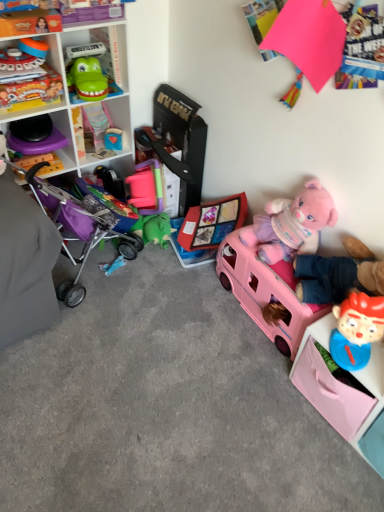
Question: From a real-world perspective, relative to purple fabric stroller at left, is matte plastic shelf at upper left, the 1th shelf from the top, vertically above or below?

Choices:
 (A) below
 (B) above

Answer: (B)

Question: Would you say matte plastic shelf at upper left, the second shelf when ordered from right to left, is inside or outside purple fabric stroller at left?

Choices:
 (A) outside
 (B) inside

Answer: (A)

Question: Estimate the real-world distances between objects in this image. Which object is farther from the purple plastic cabinet at left, positioned as the first cabinet in left-to-right order?

Choices:
 (A) pink plastic toy car at lower right, which appears as the fifth toy when viewed from the left
 (B) rubber duck at center, placed as the 5th toy when sorted from right to left
 (C) pink plush bear at right, which appears as the sixth toy when viewed from the left
 (D) matte plastic shelf at upper left, the second shelf when ordered from right to left
 (E) blue plastic toy at lower right, the seventh toy in the left-to-right sequence

Answer: (E)

Question: Which of these objects is positioned farthest from the pink plush bear at right, which ranks as the second toy in right-to-left order?

Choices:
 (A) pink plastic shelf at lower right, which is counted as the 2th shelf, starting from the top
 (B) green plastic toy at upper left, the 2th cabinet from the bottom
 (C) purple plastic cabinet at left, which ranks as the second cabinet in right-to-left order
 (D) rubber duck at center, which is the 3th toy in left-to-right order
 (E) blue rubber toy at lower left, the 4th toy in the left-to-right sequence

Answer: (C)